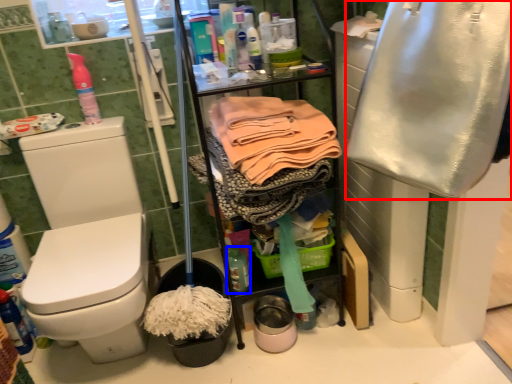
Question: Which object appears closest to the camera in this image, clothing (highlighted by a red box) or bottle (highlighted by a blue box)?

Choices:
 (A) clothing
 (B) bottle

Answer: (A)